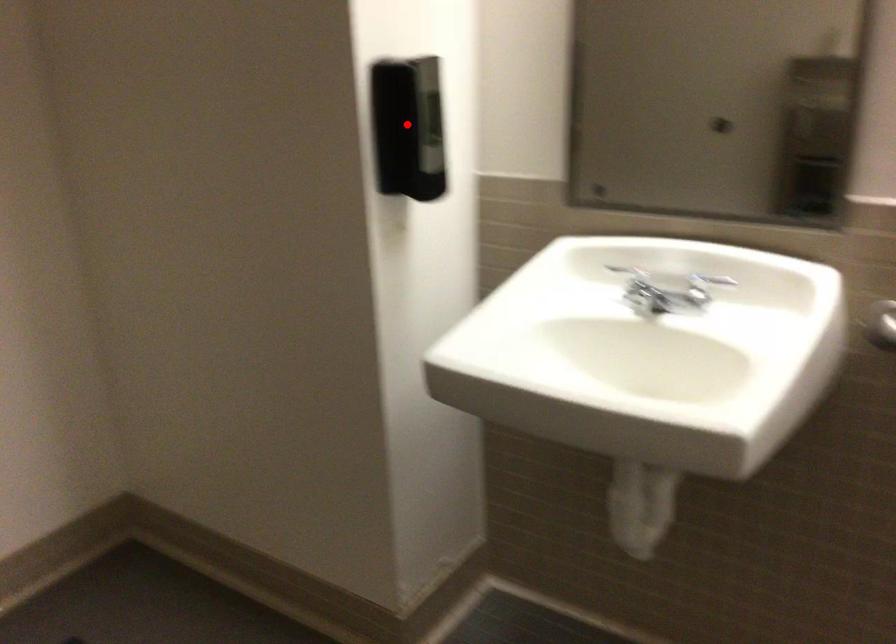
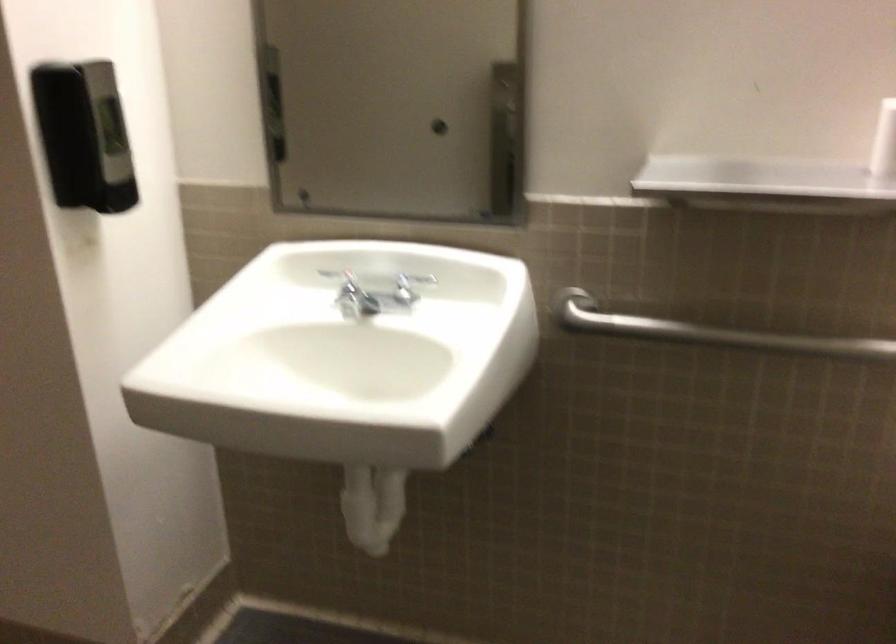
The point at the highlighted location is marked in the first image. Where is the corresponding point in the second image?

(83, 136)